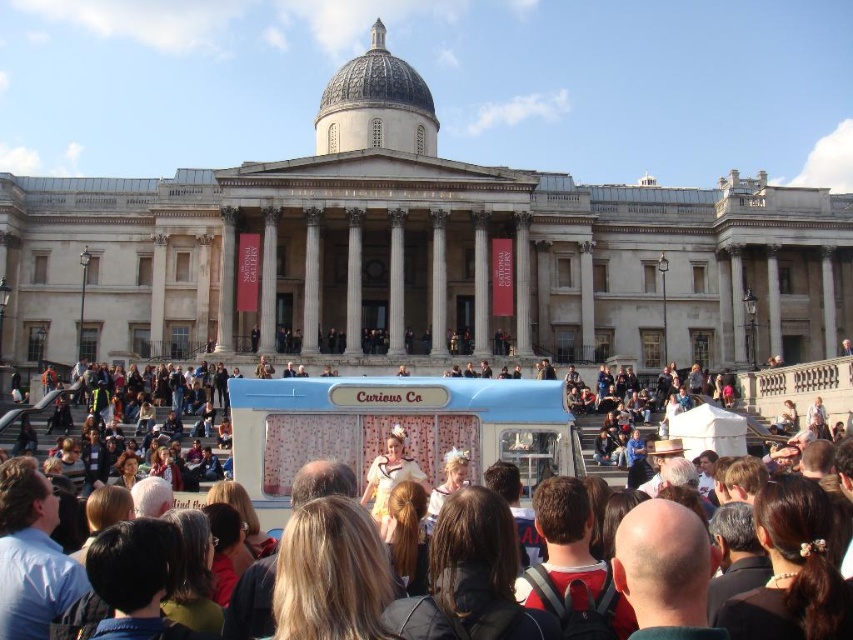
Question: Which object appears closest to the camera in this image?

Choices:
 (A) matte white ice cream truck at center
 (B) blue fabric food truck at center

Answer: (A)

Question: Which of the following is the farthest from the observer?

Choices:
 (A) matte white ice cream truck at center
 (B) blue fabric food truck at center

Answer: (B)

Question: Is matte white ice cream truck at center to the right of blue fabric food truck at center from the viewer's perspective?

Choices:
 (A) yes
 (B) no

Answer: (A)

Question: Which point appears farthest from the camera in this image?

Choices:
 (A) (247, 401)
 (B) (251, 481)

Answer: (A)

Question: Can you confirm if matte white ice cream truck at center is positioned to the left of blue fabric food truck at center?

Choices:
 (A) yes
 (B) no

Answer: (B)

Question: Is matte white ice cream truck at center positioned in front of blue fabric food truck at center?

Choices:
 (A) no
 (B) yes

Answer: (B)